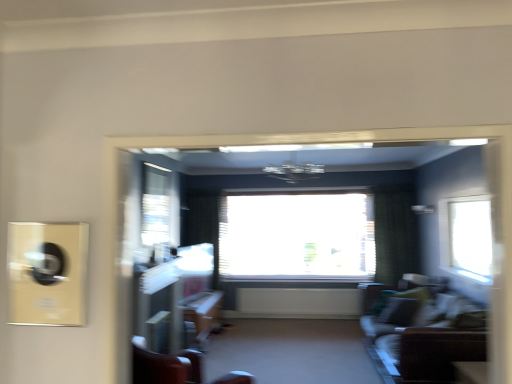
Question: Should I look upward or downward to see transparent glass window at center, the 1th window positioned from the back?

Choices:
 (A) up
 (B) down

Answer: (B)

Question: Can we say wooden chair at center lies outside transparent glass window at upper center, the second window when ordered from front to back?

Choices:
 (A) yes
 (B) no

Answer: (A)

Question: From a real-world perspective, is wooden chair at center on transparent glass window at upper center, the third window when ordered from right to left?

Choices:
 (A) no
 (B) yes

Answer: (A)

Question: From the image's perspective, is wooden chair at center above transparent glass window at upper center, which appears as the 2th window when viewed from the back?

Choices:
 (A) no
 (B) yes

Answer: (A)

Question: From a real-world perspective, is wooden chair at center located beneath transparent glass window at upper center, which appears as the 2th window when viewed from the back?

Choices:
 (A) yes
 (B) no

Answer: (A)

Question: Is wooden chair at center at the left side of transparent glass window at upper center, the second window when ordered from front to back?

Choices:
 (A) yes
 (B) no

Answer: (B)

Question: Can you confirm if wooden chair at center is taller than transparent glass window at upper center, the second window when ordered from front to back?

Choices:
 (A) yes
 (B) no

Answer: (B)

Question: Considering the relative positions of transparent glass window at upper center, acting as the first window starting from the left, and matte gray carpet at center in the image provided, is transparent glass window at upper center, acting as the first window starting from the left, to the right of matte gray carpet at center from the viewer's perspective?

Choices:
 (A) no
 (B) yes

Answer: (A)

Question: Can you confirm if transparent glass window at upper center, the third window when ordered from right to left, is taller than matte gray carpet at center?

Choices:
 (A) yes
 (B) no

Answer: (B)

Question: Can you confirm if transparent glass window at upper center, the second window when ordered from front to back, is shorter than matte gray carpet at center?

Choices:
 (A) yes
 (B) no

Answer: (A)

Question: Is transparent glass window at upper center, acting as the first window starting from the left, surrounding matte gray carpet at center?

Choices:
 (A) yes
 (B) no

Answer: (B)

Question: Is transparent glass window at upper center, the second window when ordered from front to back, not inside matte gray carpet at center?

Choices:
 (A) no
 (B) yes

Answer: (B)

Question: Considering the relative positions of transparent glass window at upper center, the third window when ordered from right to left, and matte gray carpet at center in the image provided, is transparent glass window at upper center, the third window when ordered from right to left, to the left of matte gray carpet at center from the viewer's perspective?

Choices:
 (A) no
 (B) yes

Answer: (B)